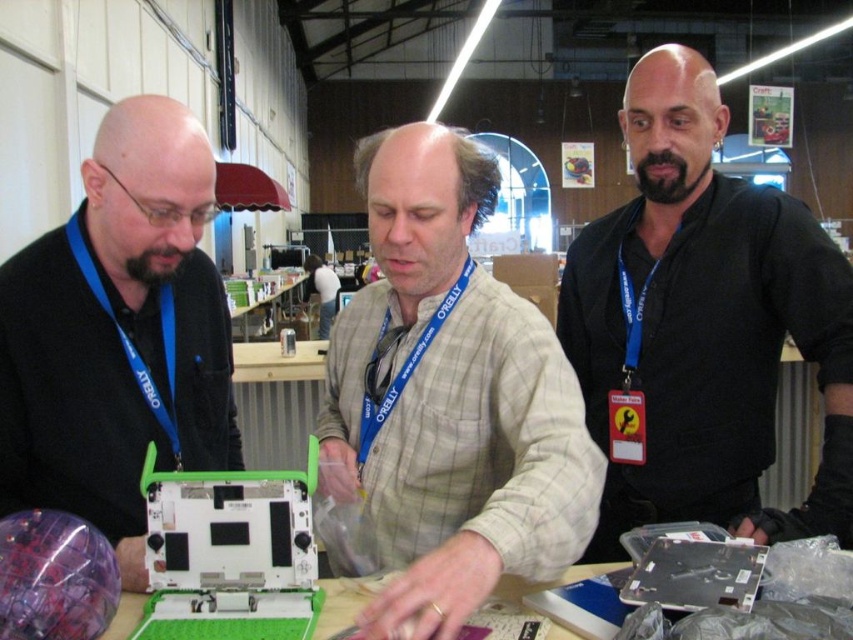
You are a photographer positioned at the entrance of the convention center. You want to capture a photo that includes both the black matte shirt at upper right and the matte black laptop at left. Based on their positions, which object should you adjust your camera angle to focus on first to ensure both are in frame?

The black matte shirt at upper right is to the right of the matte black laptop at left. To include both in the frame, adjust your camera angle to first focus on the matte black laptop at left before panning towards the black matte shirt at upper right.

You are at an exhibition hall and see two people wearing the light brown plaid shirt at center and the black matte shirt at upper right. Which one is positioned lower in the image?

The light brown plaid shirt at center is located below the black matte shirt at upper right, so the person wearing the light brown plaid shirt at center is positioned lower in the image.

You are standing at the center of the convention hall and want to place a new object at the same 2D coordinates as the matte black laptop at left. What are the coordinates you should use?

The coordinates for the matte black laptop at left are at point (119, 333). So you should place the new object at the same coordinates (119, 333).